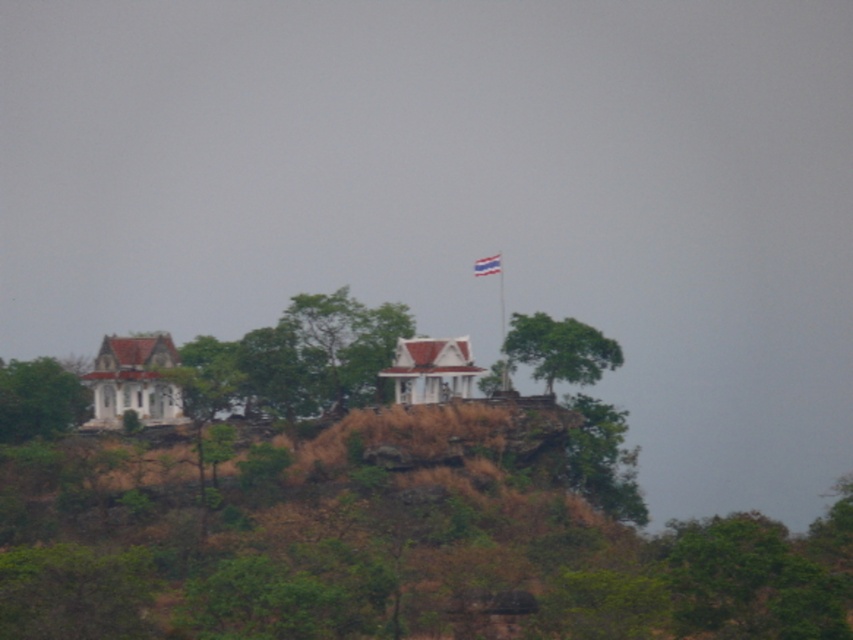
You are a drone operator tasked with capturing aerial footage of the two traditional buildings on the hill. Your drone has a maximum flight range of 150 feet. If you are currently positioned at the green leafy tree at upper center, can you fly your drone to the blue fabric flag at upper center without exceeding its range?

The distance between the green leafy tree at upper center and the blue fabric flag at upper center is 163.68 feet, which exceeds the drone operator maximum flight range of 150 feet. Therefore, the drone cannot reach the blue fabric flag at upper center without exceeding its range.

You are a tourist standing at the base of the hill looking up. You see the green leafy tree at upper center and the blue fabric flag at upper center. Which object is closer to your right side?

The green leafy tree at upper center is positioned on the right side of the blue fabric flag at upper center, so from your perspective at the base of the hill, the green leafy tree at upper center would be closer to your right side.